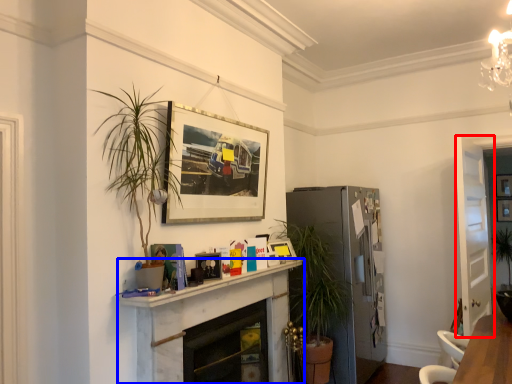
Question: Among these objects, which one is nearest to the camera, glass door (highlighted by a red box) or fireplace (highlighted by a blue box)?

Choices:
 (A) glass door
 (B) fireplace

Answer: (B)